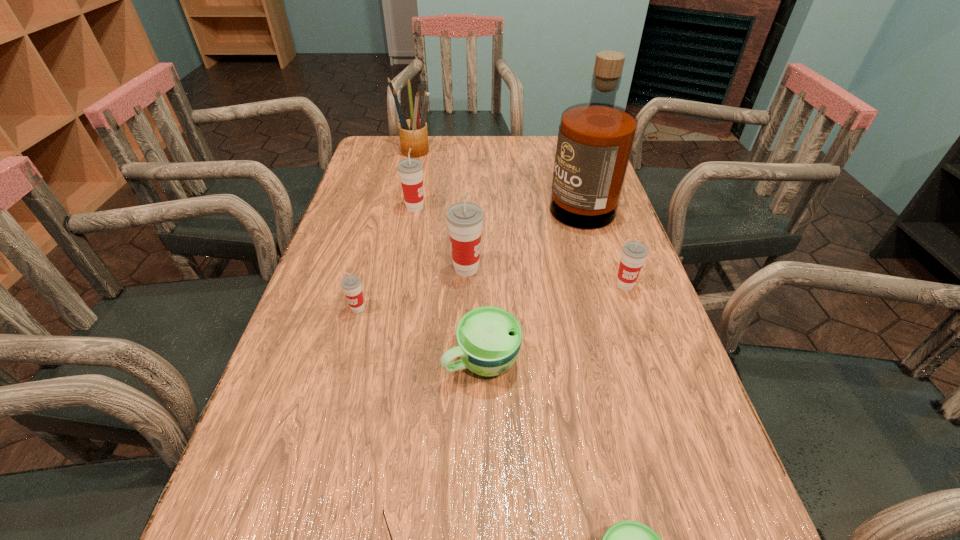
Locate an element on the screen. Image resolution: width=960 pixels, height=540 pixels. blank area located on the side of the third nearest cup with the logo is located at coordinates (342, 367).

I want to click on vacant space located 0.250m on the back of the left blue cup, so click(481, 255).

The height and width of the screenshot is (540, 960). What are the coordinates of `liquor located in the far edge section of the desktop` in the screenshot? It's located at (595, 140).

This screenshot has width=960, height=540. What are the coordinates of `pencil box present at the far edge` in the screenshot? It's located at (413, 133).

You are a GUI agent. You are given a task and a screenshot of the screen. Output one action in this format:
    pyautogui.click(x=<x>, y=<y>)
    Task: Click on the pencil box at the left edge
    
    Given the screenshot: What is the action you would take?
    pyautogui.click(x=413, y=133)

Find the location of a particular element. The width and height of the screenshot is (960, 540). cup that is at the left edge is located at coordinates (351, 284).

You are a GUI agent. You are given a task and a screenshot of the screen. Output one action in this format:
    pyautogui.click(x=<x>, y=<y>)
    Task: Click on the liquor located in the right edge section of the desktop
    
    Given the screenshot: What is the action you would take?
    pyautogui.click(x=595, y=140)

I want to click on cup situated at the right edge, so click(x=634, y=253).

Where is `object that is at the far left corner`? This screenshot has height=540, width=960. object that is at the far left corner is located at coordinates (413, 133).

Identify the location of object present at the far right corner. (595, 140).